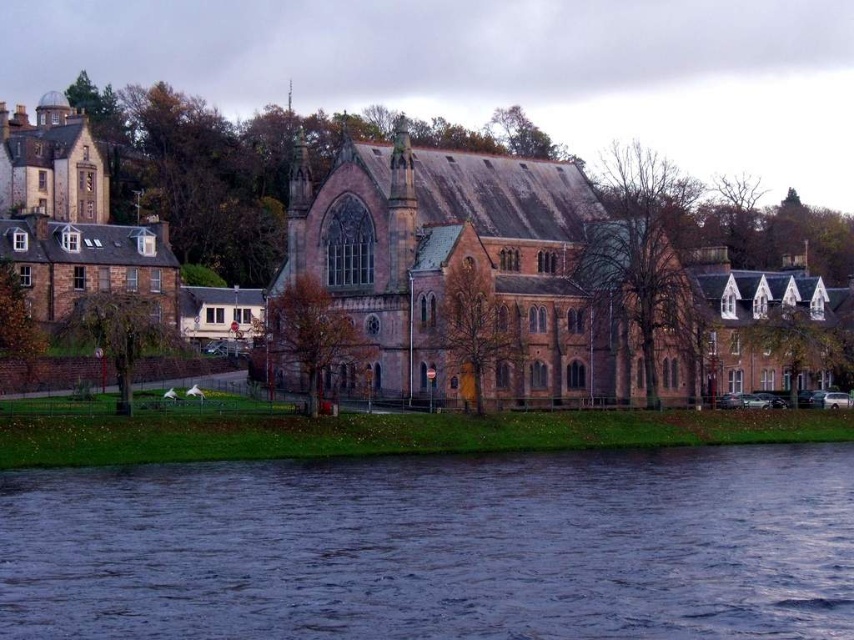
Question: Does dark blue water at lower center come in front of brown stone church at center?

Choices:
 (A) no
 (B) yes

Answer: (B)

Question: Which object is farther from the camera taking this photo?

Choices:
 (A) dark blue water at lower center
 (B) brown stone church at center

Answer: (B)

Question: Among these points, which one is farthest from the camera?

Choices:
 (A) (535, 278)
 (B) (379, 460)

Answer: (A)

Question: Which point is closer to the camera?

Choices:
 (A) brown stone church at center
 (B) dark blue water at lower center

Answer: (B)

Question: Does dark blue water at lower center have a lesser width compared to brown stone church at center?

Choices:
 (A) no
 (B) yes

Answer: (A)

Question: Can you confirm if dark blue water at lower center is thinner than brown stone church at center?

Choices:
 (A) yes
 (B) no

Answer: (B)